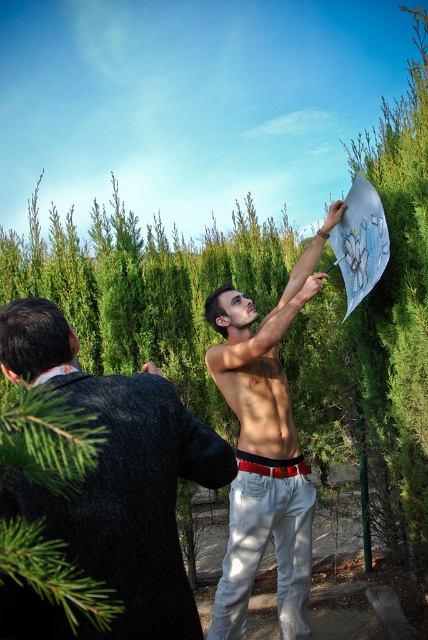
You are a photographer trying to capture a candid shot of the two subjects in the scene. The smooth gray suit at left and the muscular tan skin at center are positioned such that their widths are different. If you want to frame both subjects equally in your photo, which subject should you move closer to, and why?

You should move closer to the smooth gray suit at left because its width surpasses that of the muscular tan skin at center. By moving closer to the wider subject, you can balance their apparent sizes in the frame.